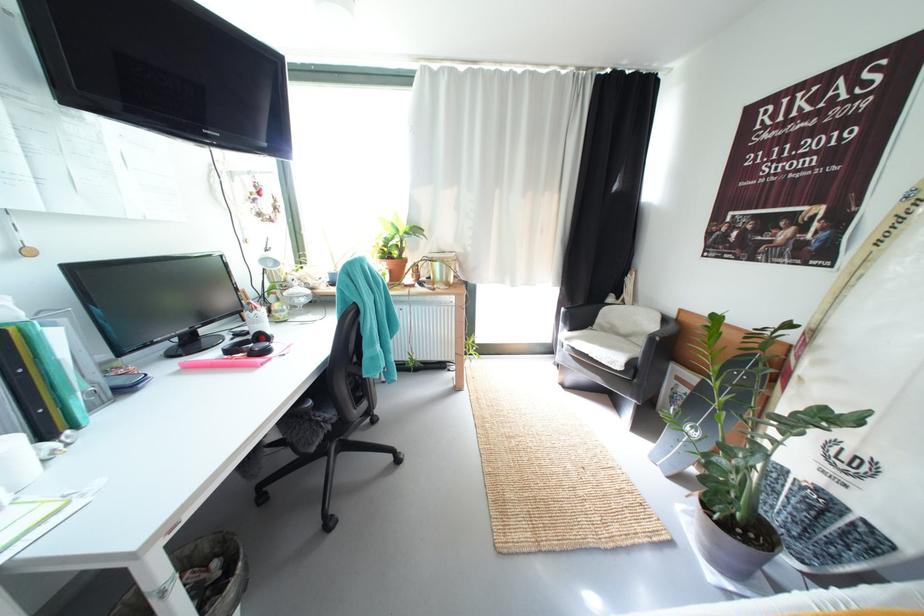
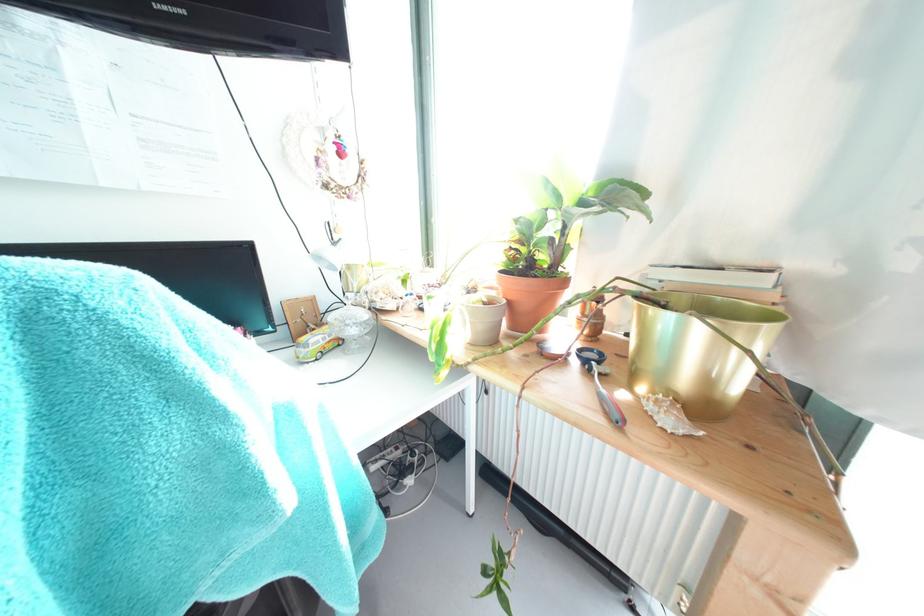
In the second image, find the point that corresponds to (444,267) in the first image.

(675, 321)